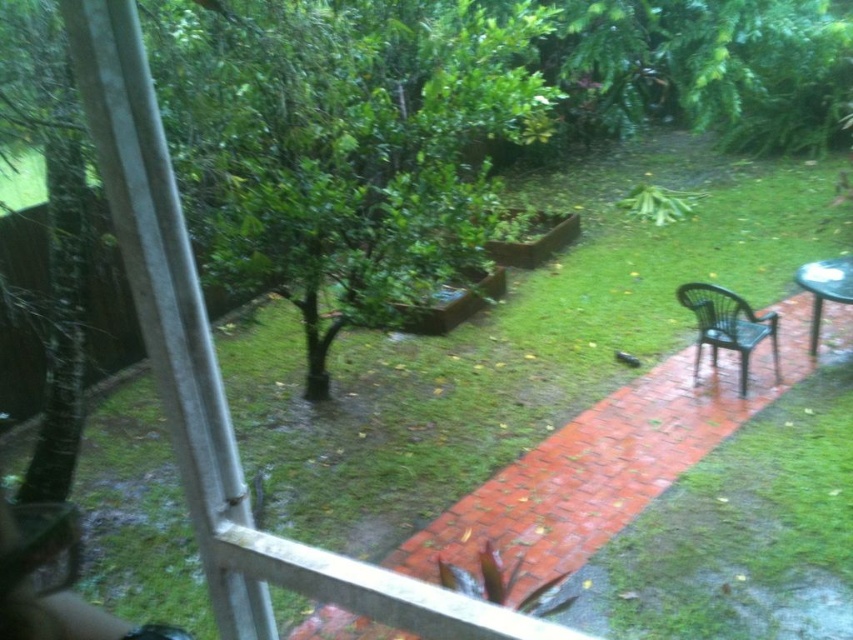
Is black plastic chair at right behind metallic silver table at right?

No, black plastic chair at right is in front of metallic silver table at right.

Who is more forward, (772,333) or (817,294)?

Point (817,294) is in front.

Identify the location of black plastic chair at right. This screenshot has width=853, height=640. (728, 326).